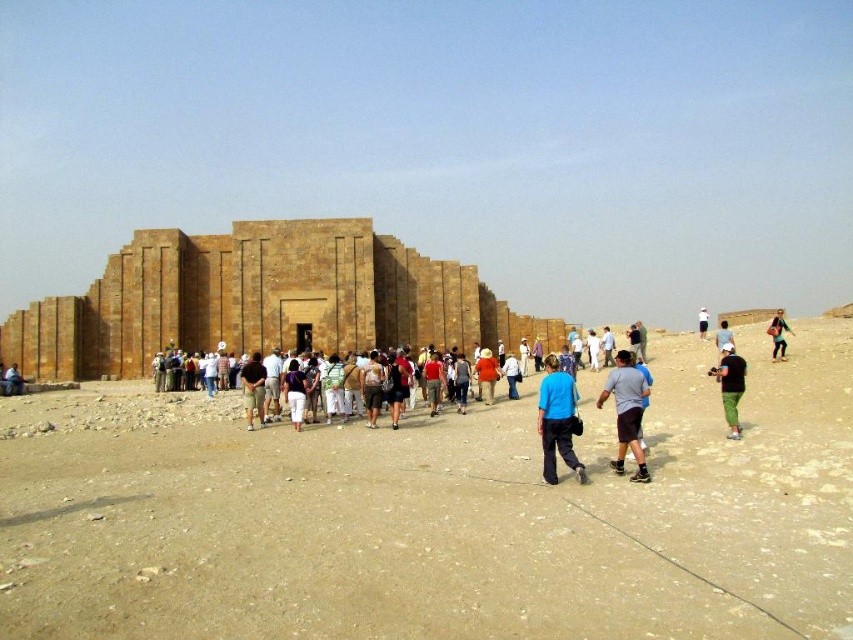
Based on the photo, you are a photographer planning to capture a group photo of the people at the ancient site. You need to ensure that both the black cotton shirt at center and the green fabric pants at right are clearly visible in the frame. Given their spatial relationship, which object should you prioritize positioning closer to the camera to ensure visibility?

The black cotton shirt at center should be positioned closer to the camera since it occupies less space than the green fabric pants at right, making it potentially harder to see from a distance.

You are standing at point (x=724, y=392) and want to reach the entrance of the ancient structure. The path to the entrance is straight and unobstructed. If your walking speed is 1.5 meters per second, how many seconds will it take you to reach the entrance?

The distance between you and the entrance is 72.20 meters. At a speed of 1.5 meters per second, dividing the distance by the speed gives 72.20 divided by 1.5 equals approximately 48.13 seconds. So, it will take about 48 seconds to reach the entrance.

You are a tour guide leading a group at this ancient desert site. You notice two tourists wearing a black cotton shirt at center and green fabric pants at right. You want to ensure they stay within the 15 meter safety zone for group cohesion. Are both tourists within the safety zone?

The distance between the black cotton shirt at center and green fabric pants at right is 14.36 meters, which is within the 15 meter safety zone. Therefore, both tourists are within the safety zone.